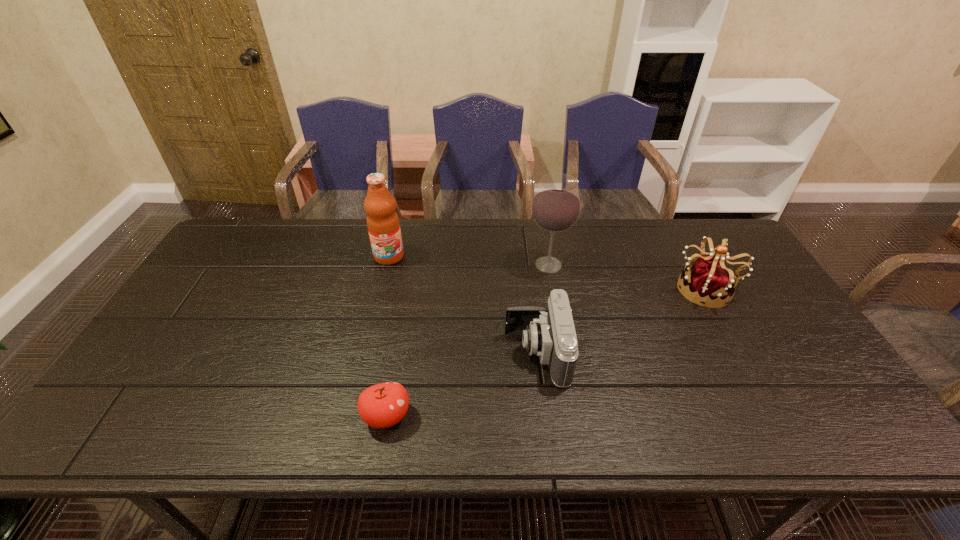
Locate an element on the screen. vacant space situated 0.330m on the front-facing side of the rightmost object is located at coordinates (565, 289).

At what (x,y) coordinates should I click in order to perform the action: click on vacant space located 0.210m on the front-facing side of the rightmost object. Please return your answer as a coordinate pair (x, y). Looking at the image, I should click on (606, 289).

Locate an element on the screen. The height and width of the screenshot is (540, 960). vacant space located 0.120m on the front-facing side of the rightmost object is located at coordinates (636, 289).

Find the location of a particular element. This screenshot has width=960, height=540. free space located 0.300m at the front of the camera with an open lens cover is located at coordinates (390, 354).

Locate an element on the screen. Image resolution: width=960 pixels, height=540 pixels. blank space located at the front of the camera with an open lens cover is located at coordinates (486, 354).

Where is `free space located 0.150m at the front of the camera with an open lens cover`? free space located 0.150m at the front of the camera with an open lens cover is located at coordinates (447, 354).

The height and width of the screenshot is (540, 960). I want to click on vacant region located on the right of the shortest object, so click(x=542, y=416).

You are a GUI agent. You are given a task and a screenshot of the screen. Output one action in this format:
    pyautogui.click(x=<x>, y=<y>)
    Task: Click on the alcohol situated at the far edge
    This screenshot has height=540, width=960.
    Given the screenshot: What is the action you would take?
    pyautogui.click(x=556, y=206)

At what (x,y) coordinates should I click in order to perform the action: click on fruit juice that is positioned at the far edge. Please return your answer as a coordinate pair (x, y). Looking at the image, I should click on (383, 224).

This screenshot has width=960, height=540. Find the location of `object that is at the near edge`. object that is at the near edge is located at coordinates (383, 405).